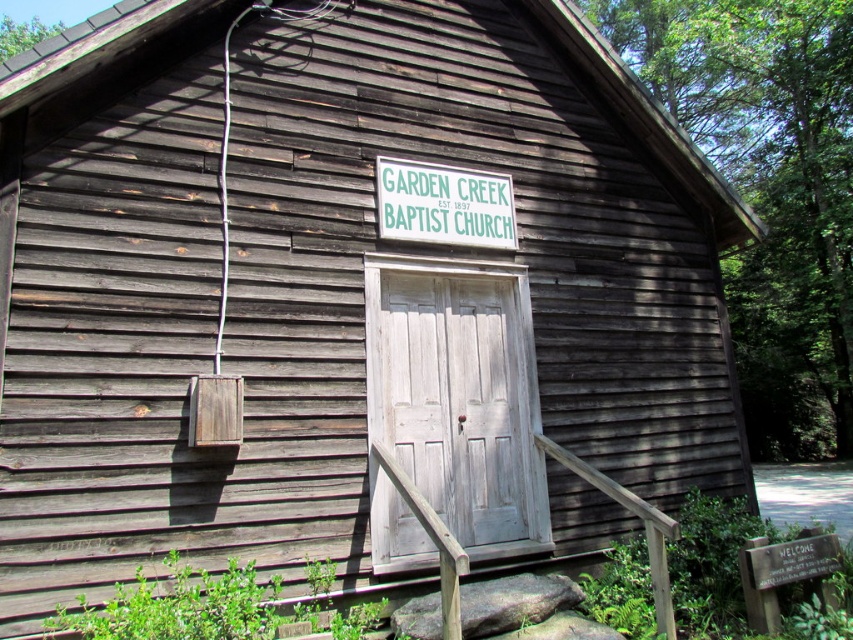
Is the position of white wood door at center more distant than that of green wooden sign at center?

No, white wood door at center is closer to the viewer.

How much distance is there between white wood door at center and green wooden sign at center?

white wood door at center and green wooden sign at center are 37.78 inches apart.

Who is more distant from viewer, (437, 502) or (450, 221)?

The point (450, 221) is behind.

The height and width of the screenshot is (640, 853). I want to click on white wood door at center, so click(x=453, y=408).